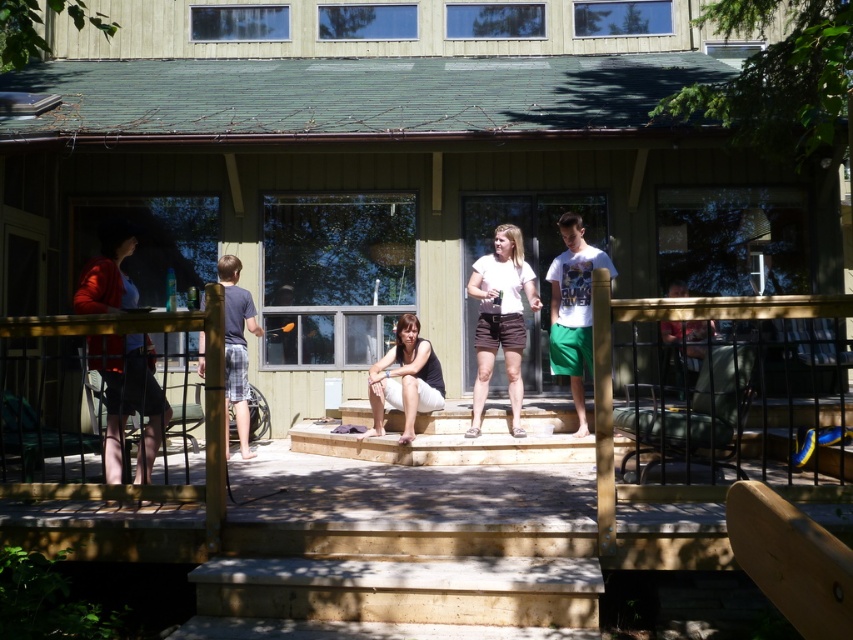
Who is shorter, wooden deck at center or black fabric at center?

wooden deck at center is shorter.

Is wooden deck at center taller than black fabric at center?

Incorrect, wooden deck at center's height is not larger of black fabric at center's.

Who is more forward, (x=96, y=488) or (x=396, y=394)?

Positioned in front is point (x=96, y=488).

This screenshot has width=853, height=640. I want to click on wooden deck at center, so click(x=204, y=406).

Is wooden deck at center positioned in front of white cotton t-shirt at center?

Yes, it is.

Between point (68, 488) and point (560, 276), which one is positioned in front?

Point (68, 488) is in front.

Locate an element on the screen. wooden deck at center is located at coordinates (204, 406).

Based on the photo, can you confirm if matte red shirt at left is positioned to the right of white cotton shirt at center?

In fact, matte red shirt at left is to the left of white cotton shirt at center.

What do you see at coordinates (128, 397) in the screenshot? I see `matte red shirt at left` at bounding box center [128, 397].

Which is in front, point (155, 424) or point (477, 381)?

Point (155, 424) is more forward.

Find the location of a particular element. The width and height of the screenshot is (853, 640). matte red shirt at left is located at coordinates (128, 397).